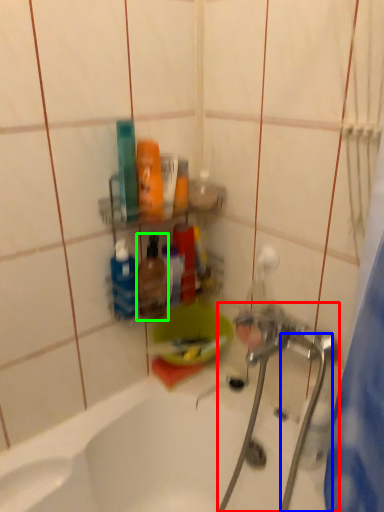
Question: Considering the real-world distances, which object is closest to plumbing fixture (highlighted by a red box)? water pipe (highlighted by a blue box) or mouthwash (highlighted by a green box).

Choices:
 (A) water pipe
 (B) mouthwash

Answer: (A)